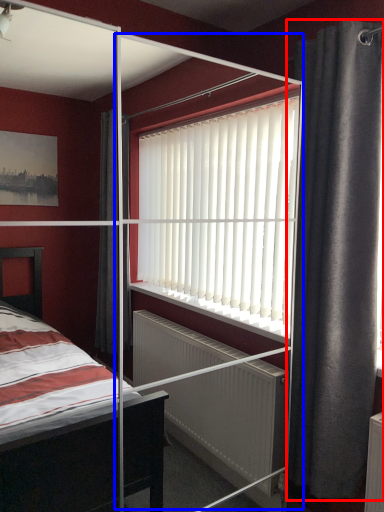
Question: Which object appears closest to the camera in this image, curtain (highlighted by a red box) or screen door (highlighted by a blue box)?

Choices:
 (A) curtain
 (B) screen door

Answer: (B)